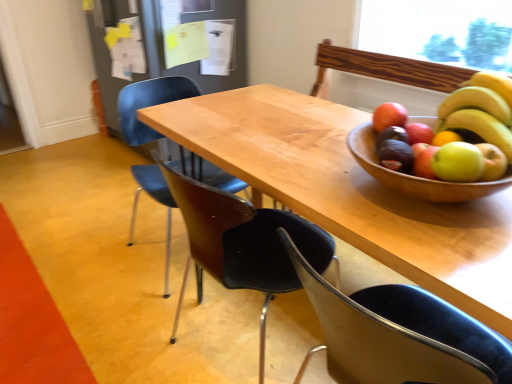
Locate an element on the screen. The height and width of the screenshot is (384, 512). vacant space that is to the left of brown leather chair at center, the second chair viewed from the back is located at coordinates (134, 336).